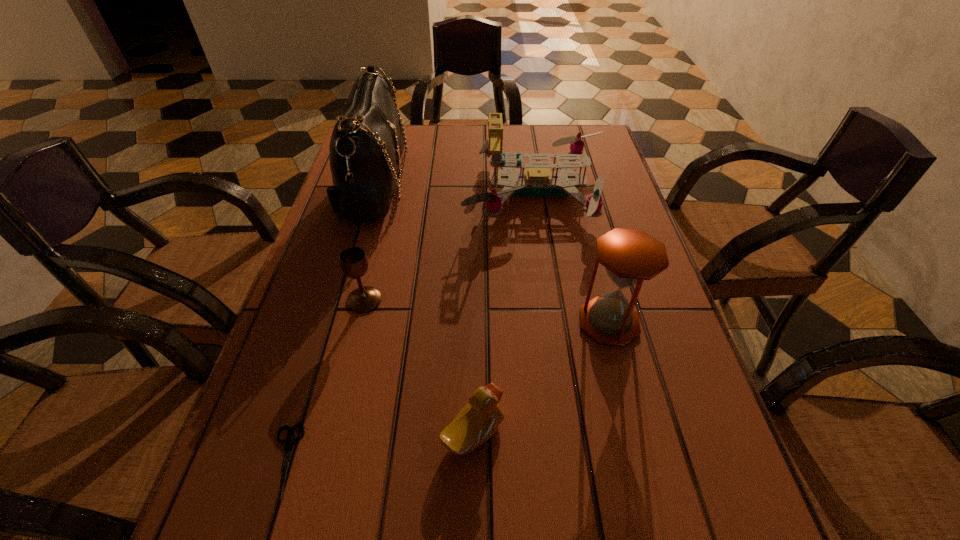
Identify the location of hourglass positioned at the right edge. The image size is (960, 540). (629, 256).

The width and height of the screenshot is (960, 540). In order to click on object positioned at the far left corner in this screenshot , I will do `click(367, 143)`.

Find the location of `object at the far right corner`. object at the far right corner is located at coordinates (538, 180).

I want to click on vacant space at the far edge, so click(x=453, y=152).

At what (x,y) coordinates should I click in order to perform the action: click on vacant space at the left edge. Please return your answer as a coordinate pair (x, y). The height and width of the screenshot is (540, 960). Looking at the image, I should click on (238, 510).

At what (x,y) coordinates should I click in order to perform the action: click on free space at the right edge of the desktop. Please return your answer as a coordinate pair (x, y). This screenshot has height=540, width=960. Looking at the image, I should click on (622, 428).

Identify the location of free space at the far right corner of the desktop. (595, 150).

This screenshot has width=960, height=540. In order to click on empty location between the drone and the fifth tallest object in this screenshot , I will do `click(505, 312)`.

This screenshot has width=960, height=540. In order to click on vacant point located between the drone and the hourglass in this screenshot , I will do `click(573, 256)`.

The height and width of the screenshot is (540, 960). Identify the location of vacant region between the duck and the hourglass. (541, 377).